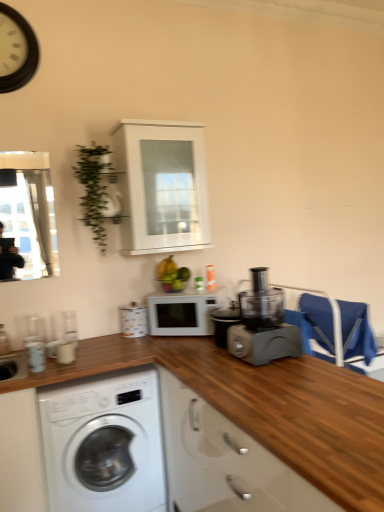
Locate an element on the screen. Image resolution: width=384 pixels, height=512 pixels. vacant area situated below green leafy plant at upper left (from a real-world perspective) is located at coordinates (107, 337).